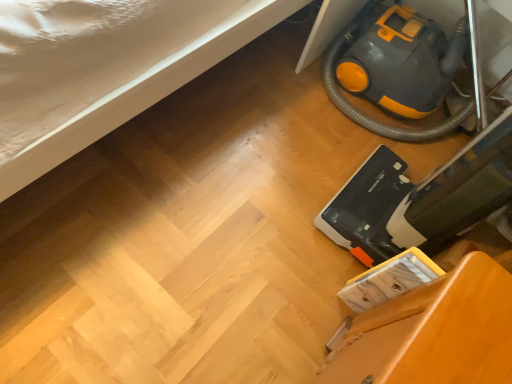
Question: In the image, is yellow-orange plastic vacuum cleaner at lower right, the first equipment viewed from the front, on the left side or the right side of yellow-orange plastic vacuum cleaner at lower right, which is counted as the second equipment, starting from the front?

Choices:
 (A) right
 (B) left

Answer: (B)

Question: Based on their sizes in the image, would you say yellow-orange plastic vacuum cleaner at lower right, the second equipment when ordered from back to front, is bigger or smaller than yellow-orange plastic vacuum cleaner at lower right, placed as the 1th equipment when sorted from back to front?

Choices:
 (A) small
 (B) big

Answer: (A)

Question: Estimate the real-world distances between objects in this image. Which object is closer to the yellow-orange plastic vacuum cleaner at lower right, which is counted as the second equipment, starting from the front?

Choices:
 (A) yellow-orange plastic vacuum cleaner at lower right, the first equipment viewed from the front
 (B) wooden chair at lower right

Answer: (A)

Question: Which is nearer to the yellow-orange plastic vacuum cleaner at lower right, which is counted as the second equipment, starting from the front?

Choices:
 (A) wooden chair at lower right
 (B) yellow-orange plastic vacuum cleaner at lower right, the first equipment viewed from the front

Answer: (B)